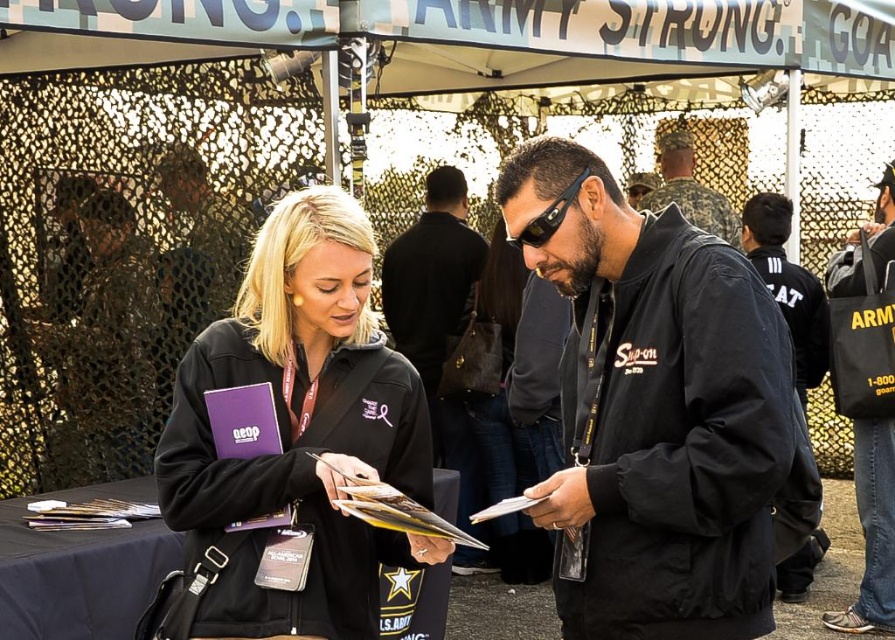
Question: Is black matte jacket at center closer to camera compared to black softshell jacket at center?

Choices:
 (A) yes
 (B) no

Answer: (A)

Question: Can you confirm if black fabric bag at right is positioned to the left of camouflage uniform at center?

Choices:
 (A) yes
 (B) no

Answer: (B)

Question: Which point is farther from the camera taking this photo?

Choices:
 (A) (361, 237)
 (B) (461, 269)
 (C) (587, 416)
 (D) (716, 200)

Answer: (D)

Question: Is the position of black matte jacket at center more distant than that of camouflage uniform at center?

Choices:
 (A) no
 (B) yes

Answer: (A)

Question: Which of the following is the closest to the observer?

Choices:
 (A) (454, 412)
 (B) (821, 358)

Answer: (A)

Question: Which of the following is the closest to the observer?

Choices:
 (A) camouflage uniform at center
 (B) black fabric bag at right
 (C) black fabric jacket at right

Answer: (B)